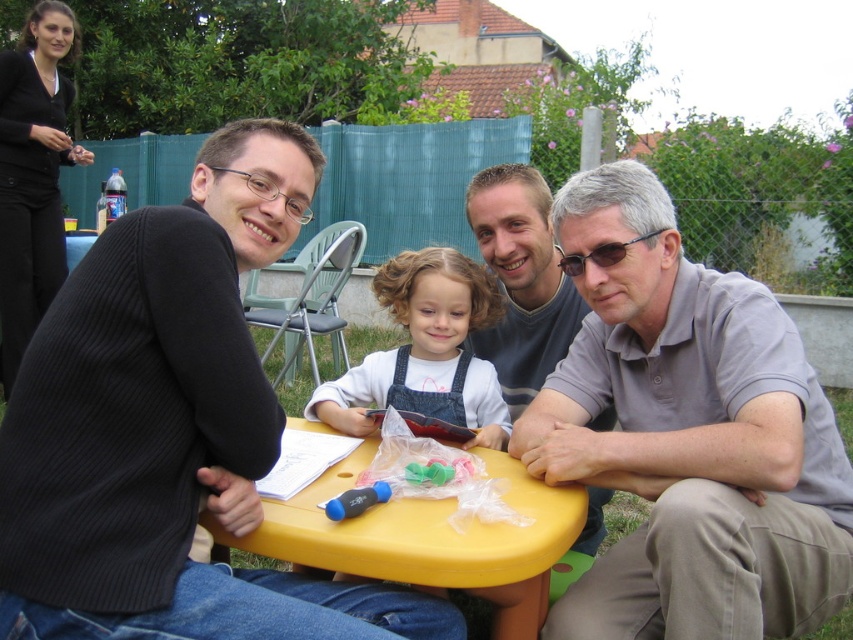
Question: Which point is farther to the camera?

Choices:
 (A) (631, 308)
 (B) (351, 417)

Answer: (B)

Question: Which object is positioned farthest from the gray cotton shirt at upper center?

Choices:
 (A) gray cotton shirt at center
 (B) black ribbed sweater at upper left

Answer: (B)

Question: Can you confirm if black ribbed sweater at upper left is bigger than yellow plastic table at center?

Choices:
 (A) no
 (B) yes

Answer: (B)

Question: Considering the relative positions of denim overalls at center and gray cotton shirt at upper center in the image provided, where is denim overalls at center located with respect to gray cotton shirt at upper center?

Choices:
 (A) below
 (B) above

Answer: (A)

Question: Among these points, which one is farthest from the camera?

Choices:
 (A) (418, 600)
 (B) (350, 376)

Answer: (B)

Question: Does gray cotton shirt at center appear on the left side of gray cotton shirt at upper center?

Choices:
 (A) yes
 (B) no

Answer: (B)